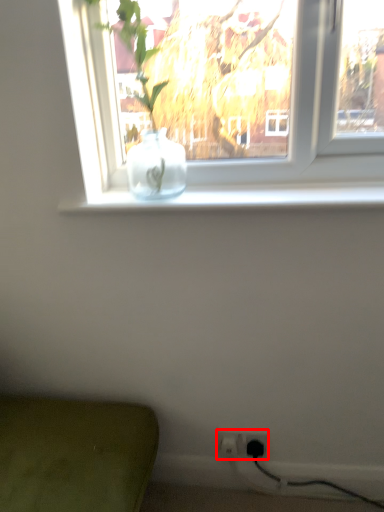
Question: Where is electric outlet (annotated by the red box) located in relation to electric outlet in the image?

Choices:
 (A) right
 (B) left

Answer: (B)